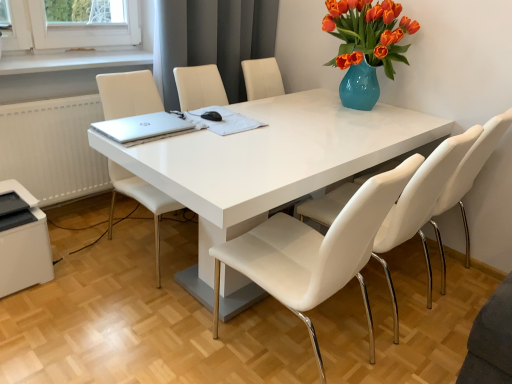
Question: Is there a large distance between white leather chair at center, which is the 2th chair from right to left, and gray fabric curtain at upper center?

Choices:
 (A) no
 (B) yes

Answer: (B)

Question: Can you confirm if white leather chair at center, which is the 2th chair from right to left, is bigger than gray fabric curtain at upper center?

Choices:
 (A) no
 (B) yes

Answer: (B)

Question: Is white leather chair at center, which ranks as the second chair in left-to-right order, to the right of gray fabric curtain at upper center from the viewer's perspective?

Choices:
 (A) no
 (B) yes

Answer: (B)

Question: From a real-world perspective, is white leather chair at center, which ranks as the second chair in left-to-right order, located higher than gray fabric curtain at upper center?

Choices:
 (A) yes
 (B) no

Answer: (B)

Question: Does white leather chair at center, which is the 2th chair from right to left, contain gray fabric curtain at upper center?

Choices:
 (A) yes
 (B) no

Answer: (B)

Question: Considering the positions of white leather chair at right, the 3th chair in the left-to-right sequence, and gray fabric curtain at upper center in the image, is white leather chair at right, the 3th chair in the left-to-right sequence, wider or thinner than gray fabric curtain at upper center?

Choices:
 (A) thin
 (B) wide

Answer: (B)

Question: Is white leather chair at right, which is the first chair from right to left, situated inside gray fabric curtain at upper center or outside?

Choices:
 (A) inside
 (B) outside

Answer: (B)

Question: Is point (467, 153) positioned closer to the camera than point (159, 11)?

Choices:
 (A) closer
 (B) farther

Answer: (A)

Question: Looking at the image, does white leather chair at right, which is the first chair from right to left, seem bigger or smaller compared to gray fabric curtain at upper center?

Choices:
 (A) small
 (B) big

Answer: (B)

Question: In terms of size, does white plastic printer at lower left appear bigger or smaller than white leather chair at center, which ranks as the second chair in left-to-right order?

Choices:
 (A) big
 (B) small

Answer: (B)

Question: From the image's perspective, relative to white leather chair at center, which is the 2th chair from right to left, is white plastic printer at lower left above or below?

Choices:
 (A) above
 (B) below

Answer: (A)

Question: Does point (53, 271) appear closer or farther from the camera than point (281, 256)?

Choices:
 (A) closer
 (B) farther

Answer: (B)

Question: From their relative heights in the image, would you say white plastic printer at lower left is taller or shorter than white leather chair at center, which ranks as the second chair in left-to-right order?

Choices:
 (A) short
 (B) tall

Answer: (A)

Question: Considering their positions, is white leather chair at center, which ranks as the second chair in left-to-right order, located in front of or behind white plastic printer at lower left?

Choices:
 (A) front
 (B) behind

Answer: (A)

Question: From a real-world perspective, relative to white plastic printer at lower left, is white leather chair at center, which ranks as the second chair in left-to-right order, vertically above or below?

Choices:
 (A) above
 (B) below

Answer: (A)